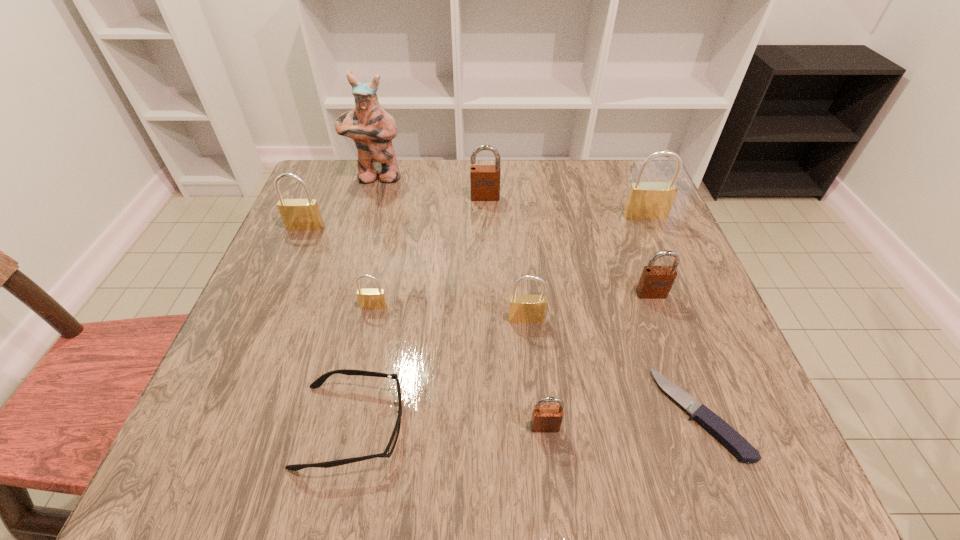
The image size is (960, 540). I want to click on the third brass padlock from left to right, so click(527, 308).

You are a GUI agent. You are given a task and a screenshot of the screen. Output one action in this format:
    pyautogui.click(x=<x>, y=<y>)
    Task: Click on the third biggest brass padlock
    This screenshot has width=960, height=540.
    Given the screenshot: What is the action you would take?
    pyautogui.click(x=527, y=308)

Where is `the second brass padlock from left to right`? the second brass padlock from left to right is located at coordinates (370, 298).

Find the location of a particular element. the third farthest brass padlock is located at coordinates (370, 298).

This screenshot has height=540, width=960. I want to click on the nearest padlock, so click(545, 418).

The image size is (960, 540). What are the coordinates of `the smallest brown padlock` in the screenshot? It's located at (545, 418).

Where is `spectacles`? Image resolution: width=960 pixels, height=540 pixels. spectacles is located at coordinates (317, 383).

In order to click on the shortest object in this screenshot , I will do [x=716, y=426].

Locate an element on the screen. The image size is (960, 540). blank area located on the front-facing side of the tallest object is located at coordinates (362, 227).

What are the coordinates of `free space located 0.150m on the front-facing side of the farthest brass padlock` in the screenshot? It's located at (664, 263).